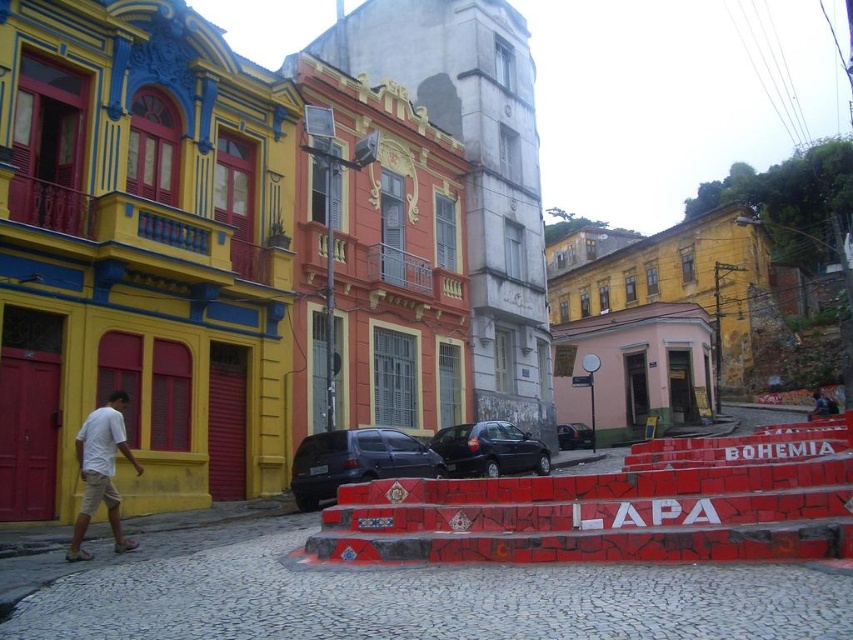
You are a photographer planning to capture a wide shot of the historic district scene. You want to ensure both the white cotton shirt at lower left and the matte black car at center are fully visible in your frame. Given their sizes, which object might require you to adjust your camera angle to avoid cropping?

The white cotton shirt at lower left has a larger width than the matte black car at center, so it might require adjusting the camera angle to ensure it fits entirely within the frame without cropping.

You are a tourist standing at the top of the red painted stone stairs at lower center and want to take a photo of the shiny black suv at center. Which object should you move closer to in order to get a better shot?

The red painted stone stairs at lower center is larger in size than the shiny black suv at center, so to get a better shot of the shiny black suv at center, you should move closer to it to capture more details.